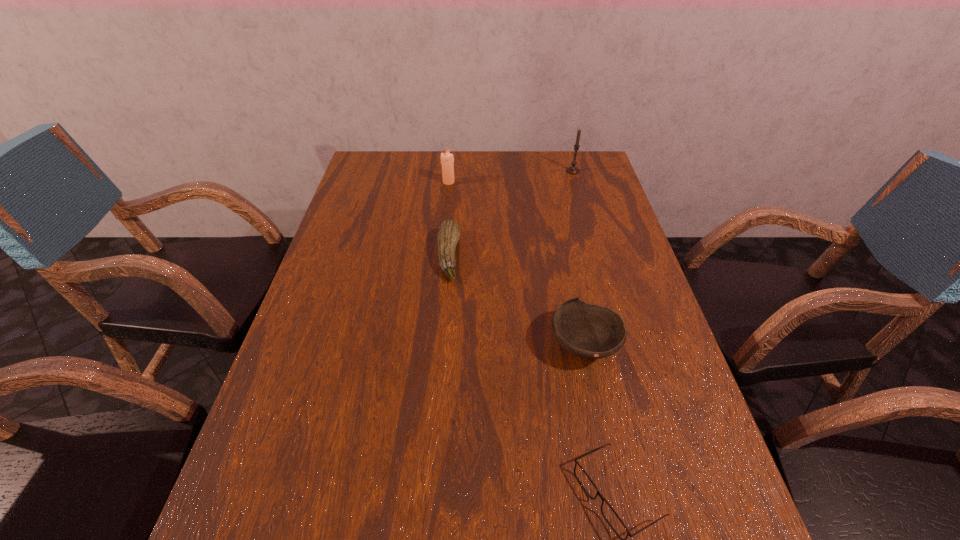
At what (x,y) coordinates should I click in order to perform the action: click on free space that satisfies the following two spatial constraints: 1. on the back side of the farthest object; 2. on the right side of the left candle. Please return your answer as a coordinate pair (x, y). Looking at the image, I should click on (449, 171).

In order to click on free space that satisfies the following two spatial constraints: 1. at the stem end of the bowl; 2. on the left side of the second shortest object in this screenshot , I will do `click(442, 345)`.

Where is `free space that satisfies the following two spatial constraints: 1. on the back side of the farther candle; 2. on the right side of the third shortest object`? free space that satisfies the following two spatial constraints: 1. on the back side of the farther candle; 2. on the right side of the third shortest object is located at coordinates pyautogui.click(x=547, y=171).